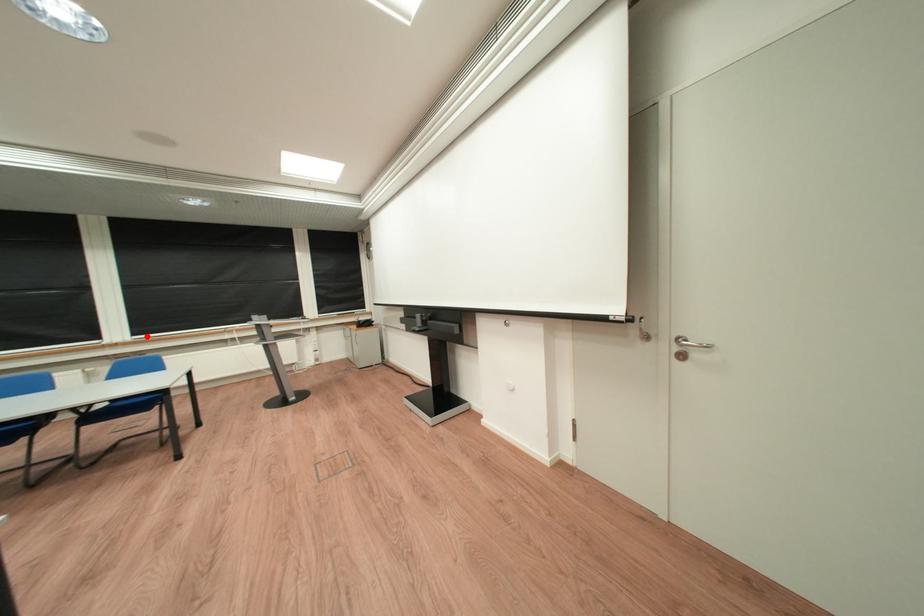
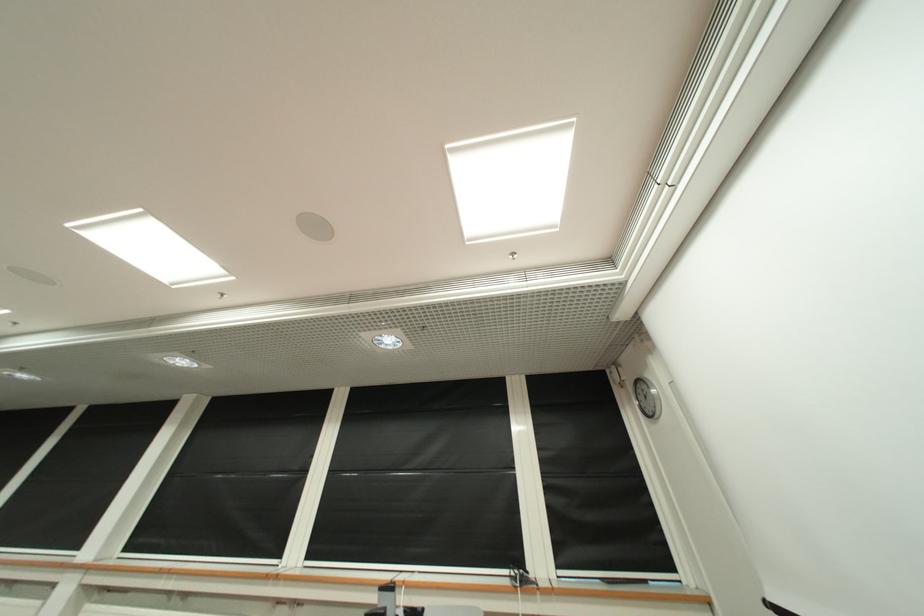
Find the pixel in the second image that matches the highlighted location in the first image.

(321, 560)